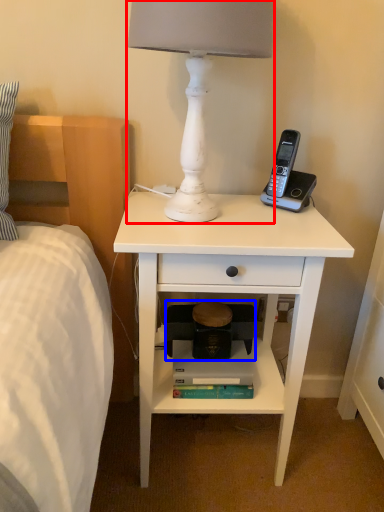
Question: Which object appears closest to the camera in this image, lamp (highlighted by a red box) or step stool (highlighted by a blue box)?

Choices:
 (A) lamp
 (B) step stool

Answer: (A)